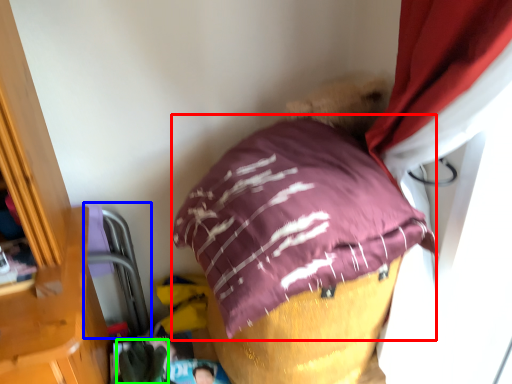
Question: Considering the real-world distances, which object is closest to pillow (highlighted by a red box)? bean bag chair (highlighted by a blue box) or clothing (highlighted by a green box).

Choices:
 (A) bean bag chair
 (B) clothing

Answer: (A)